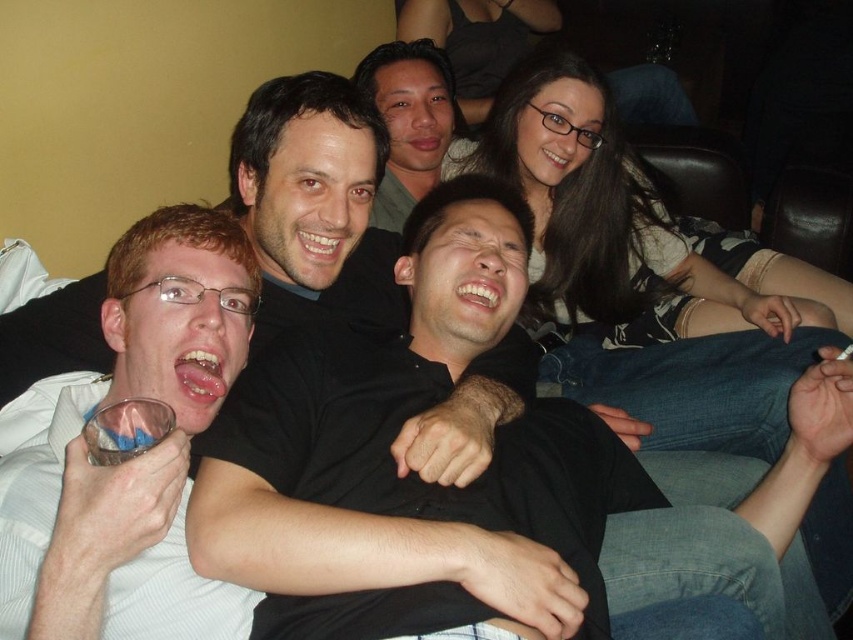
Consider the image. You are standing in front of a group photo and notice two people wearing different shirts. The white striped shirt at left and the matte black shirt at center. Which shirt is positioned closer to you?

The white striped shirt at left is closer to the viewer than the matte black shirt at center.

You are trying to decide which shirt to wear for a casual evening out. You see the black matte shirt at center and the white striped shirt at left in the image. Which one is located lower in the picture?

The black matte shirt at center is positioned under the white striped shirt at left, so it is located lower in the picture.

You are standing in the room and want to place a small decorative item between the two points, point (180, 636) and point (396, 168). Which point should you place it closer to so that it is in front of the other point?

You should place the item closer to point (180, 636) because it is in front of point (396, 168).